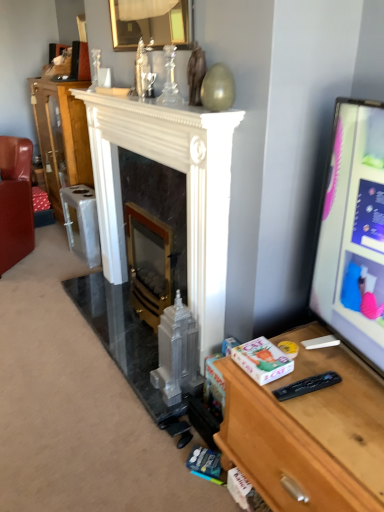
Question: Is white marble fireplace at center to the right of gold metallic fireplace at center, positioned as the 2th fireplace in left-to-right order, from the viewer's perspective?

Choices:
 (A) yes
 (B) no

Answer: (B)

Question: Considering the relative sizes of white marble fireplace at center and gold metallic fireplace at center, the first fireplace when ordered from right to left, in the image provided, is white marble fireplace at center smaller than gold metallic fireplace at center, the first fireplace when ordered from right to left,?

Choices:
 (A) yes
 (B) no

Answer: (B)

Question: Is white marble fireplace at center positioned behind gold metallic fireplace at center, positioned as the 2th fireplace in left-to-right order?

Choices:
 (A) no
 (B) yes

Answer: (B)

Question: From the image's perspective, is white marble fireplace at center above gold metallic fireplace at center, the first fireplace when ordered from right to left?

Choices:
 (A) yes
 (B) no

Answer: (A)

Question: Would you say gold metallic fireplace at center, positioned as the 2th fireplace in left-to-right order, is part of white marble fireplace at center's contents?

Choices:
 (A) no
 (B) yes

Answer: (A)

Question: From the image's perspective, is white marble fireplace at center below gold metallic fireplace at center, the first fireplace when ordered from right to left?

Choices:
 (A) no
 (B) yes

Answer: (A)

Question: Is matte black monitor at right placed right next to gold metallic fireplace at center, the first fireplace when ordered from right to left?

Choices:
 (A) no
 (B) yes

Answer: (A)

Question: Considering the relative sizes of matte black monitor at right and gold metallic fireplace at center, the first fireplace when ordered from right to left, in the image provided, is matte black monitor at right bigger than gold metallic fireplace at center, the first fireplace when ordered from right to left,?

Choices:
 (A) no
 (B) yes

Answer: (B)

Question: Is matte black monitor at right taller than gold metallic fireplace at center, positioned as the 2th fireplace in left-to-right order?

Choices:
 (A) yes
 (B) no

Answer: (B)

Question: From a real-world perspective, is matte black monitor at right beneath gold metallic fireplace at center, the first fireplace when ordered from right to left?

Choices:
 (A) yes
 (B) no

Answer: (B)

Question: Considering the relative sizes of matte black monitor at right and gold metallic fireplace at center, the first fireplace when ordered from right to left, in the image provided, is matte black monitor at right thinner than gold metallic fireplace at center, the first fireplace when ordered from right to left,?

Choices:
 (A) no
 (B) yes

Answer: (A)

Question: From a real-world perspective, does matte black monitor at right stand above gold metallic fireplace at center, positioned as the 2th fireplace in left-to-right order?

Choices:
 (A) no
 (B) yes

Answer: (B)

Question: Is leather couch at left smaller than wooden desk at right?

Choices:
 (A) no
 (B) yes

Answer: (A)